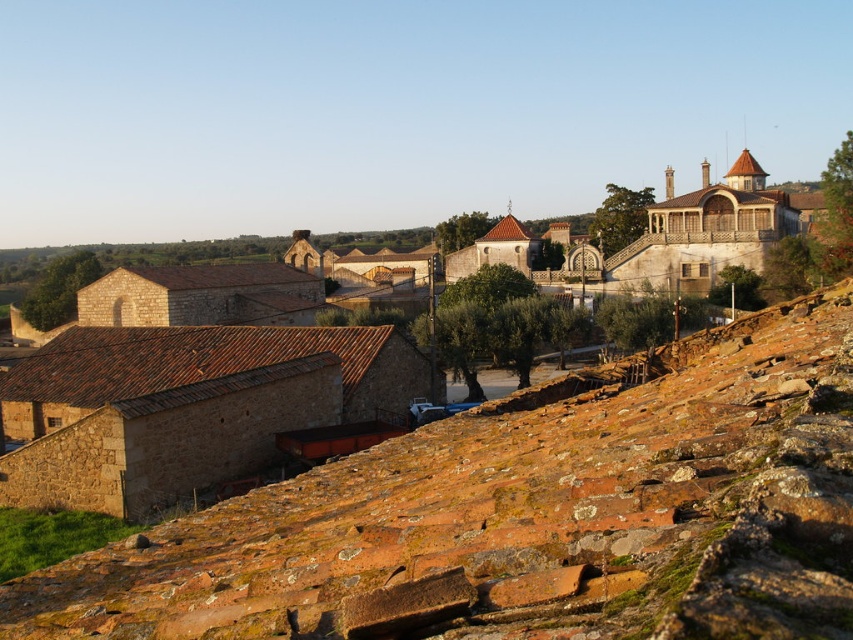
Question: Can you confirm if brown stone hillside at lower right is positioned below brown stone village at center?

Choices:
 (A) yes
 (B) no

Answer: (A)

Question: Can you confirm if brown stone hillside at lower right is positioned above brown stone village at center?

Choices:
 (A) no
 (B) yes

Answer: (A)

Question: From the image, what is the correct spatial relationship of brown stone hillside at lower right in relation to brown stone village at center?

Choices:
 (A) above
 (B) below

Answer: (B)

Question: Which object appears closest to the camera in this image?

Choices:
 (A) brown stone village at center
 (B) brown stone hillside at lower right

Answer: (B)

Question: Among these objects, which one is farthest from the camera?

Choices:
 (A) brown stone hillside at lower right
 (B) brown stone village at center

Answer: (B)

Question: Among these points, which one is farthest from the camera?

Choices:
 (A) (605, 412)
 (B) (178, 461)

Answer: (B)